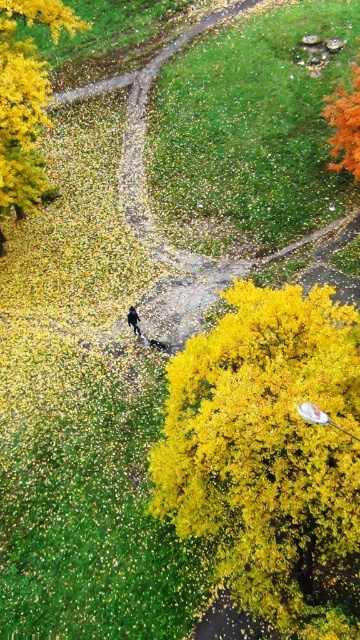
Question: Which object appears closest to the camera in this image?

Choices:
 (A) golden textured leaves at upper left
 (B) dark blue fabric at center
 (C) golden textured bush at lower right

Answer: (C)

Question: From the image, what is the correct spatial relationship of golden textured bush at lower right in relation to dark blue fabric at center?

Choices:
 (A) below
 (B) above

Answer: (A)

Question: Is golden textured bush at lower right above dark blue fabric at center?

Choices:
 (A) yes
 (B) no

Answer: (B)

Question: Among these objects, which one is farthest from the camera?

Choices:
 (A) golden textured bush at lower right
 (B) golden textured leaves at upper left
 (C) dark blue fabric at center

Answer: (C)

Question: Which of the following is the closest to the observer?

Choices:
 (A) (132, 307)
 (B) (312, 605)
 (C) (2, 205)

Answer: (B)

Question: Is golden textured bush at lower right thinner than golden textured leaves at upper left?

Choices:
 (A) no
 (B) yes

Answer: (A)